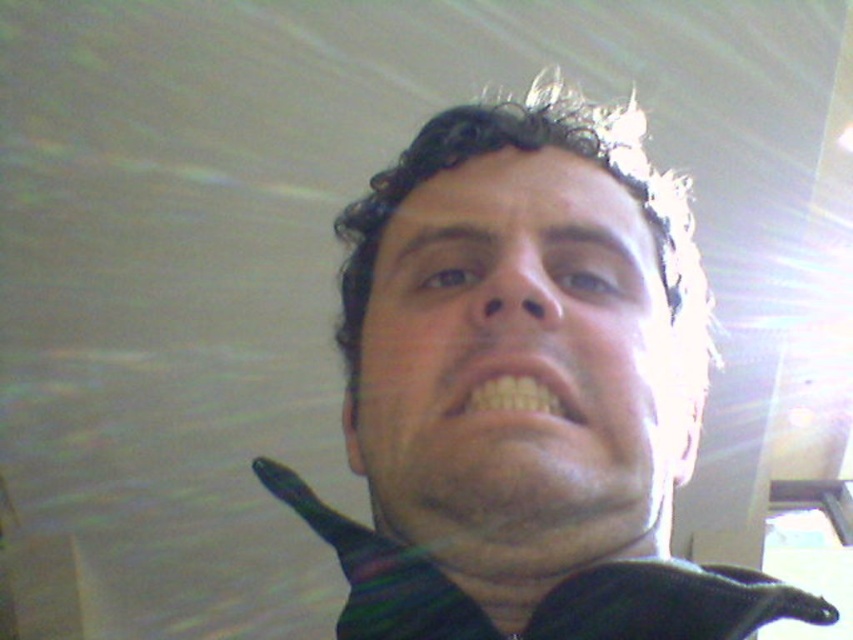
You are a photographer trying to capture a clear image of both the black matte face at center and the matte black face at center in the scene. However, you notice that the camera is focusing only on one of them. Which face is the camera more likely focusing on and why?

The camera is more likely focusing on the matte black face at center because its width is smaller than the black matte face at center, making it easier for the camera to achieve sharp focus on smaller objects.

You are a photographer adjusting your camera settings to capture a clear image of the black matte face at center. Given that the subject is 27.76 centimeters away from the camera, what is the minimum focusing distance your camera lens must support to ensure the subject is in focus?

The black matte face at center is 27.76 centimeters away from the viewer. Therefore, the camera lens must have a minimum focusing distance of at least 27.76 centimeters to capture the subject clearly.

You are a photographer adjusting lighting for a portrait. You notice two faces in the frame labeled as black matte face at center and matte black face at center. Which face appears taller in the photo?

The black matte face at center is taller than the matte black face at center.